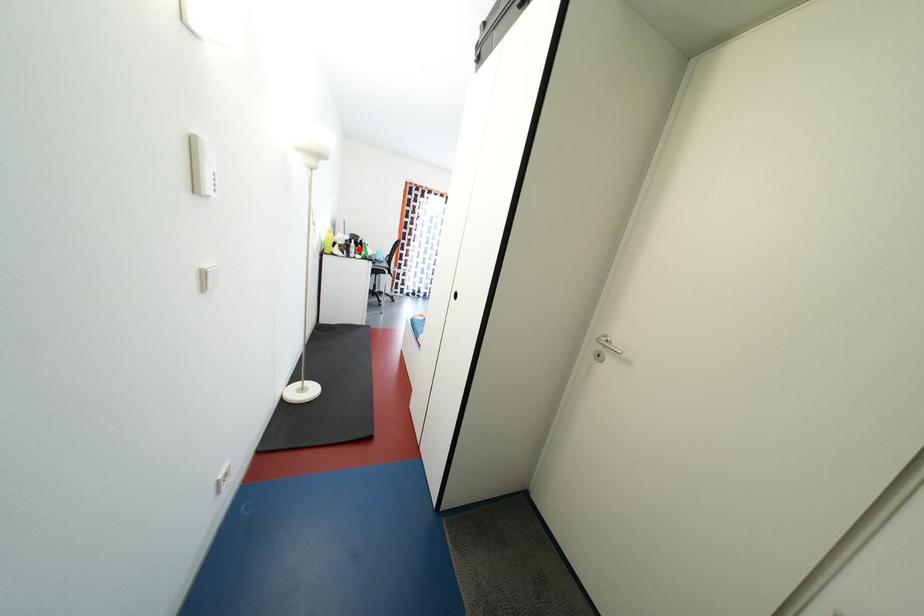
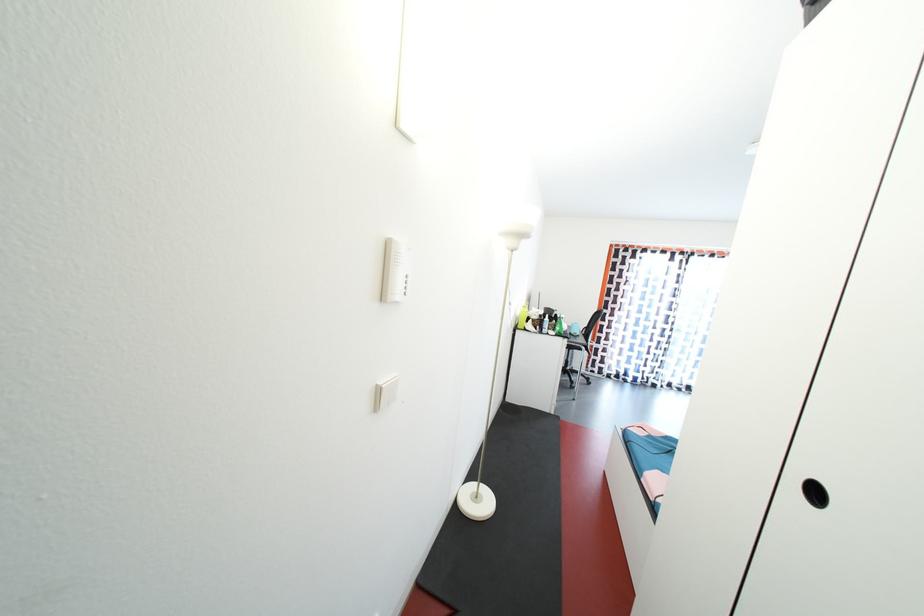
Find the pixel in the second image that matches the highlighted location in the first image.

(553, 323)